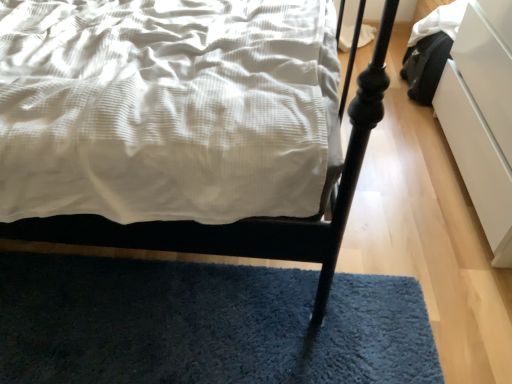
This screenshot has height=384, width=512. I want to click on white glossy drawer at right, so click(477, 161).

Consider the image. In order to face blue shaggy rug at lower center, should I rotate leftwards or rightwards?

Rotate your view left by about 7.622°.

What do you see at coordinates (205, 324) in the screenshot?
I see `blue shaggy rug at lower center` at bounding box center [205, 324].

The height and width of the screenshot is (384, 512). Find the location of `white glossy drawer at right`. white glossy drawer at right is located at coordinates (477, 161).

Which is more to the left, blue shaggy rug at lower center or matte white bed at center?

matte white bed at center is more to the left.

Can you tell me how much blue shaggy rug at lower center and matte white bed at center differ in facing direction?

blue shaggy rug at lower center and matte white bed at center are facing 89.7 degrees away from each other.

Between blue shaggy rug at lower center and matte white bed at center, which one has larger width?

matte white bed at center is wider.

Is matte white bed at center beside blue shaggy rug at lower center?

matte white bed at center and blue shaggy rug at lower center are clearly separated.

Which is behind, matte white bed at center or blue shaggy rug at lower center?

blue shaggy rug at lower center is more distant.

From the image's perspective, which one is positioned lower, matte white bed at center or blue shaggy rug at lower center?

From the image's view, blue shaggy rug at lower center is below.

The width and height of the screenshot is (512, 384). Find the location of `bed above the blue shaggy rug at lower center (from a real-world perspective)`. bed above the blue shaggy rug at lower center (from a real-world perspective) is located at coordinates (248, 218).

Is the surface of white glossy drawer at right in direct contact with matte white bed at center?

white glossy drawer at right and matte white bed at center are not in contact.

I want to click on bed above the white glossy drawer at right (from the image's perspective), so click(248, 218).

Is white glossy drawer at right positioned with its back to matte white bed at center?

white glossy drawer at right does not have its back to matte white bed at center.

Does white glossy drawer at right have a lesser width compared to blue shaggy rug at lower center?

Correct, the width of white glossy drawer at right is less than that of blue shaggy rug at lower center.

Considering the sizes of objects white glossy drawer at right and blue shaggy rug at lower center in the image provided, who is bigger, white glossy drawer at right or blue shaggy rug at lower center?

With larger size is white glossy drawer at right.

From the image's perspective, would you say white glossy drawer at right is shown under blue shaggy rug at lower center?

No, from the image's perspective, white glossy drawer at right is not beneath blue shaggy rug at lower center.

Between white glossy drawer at right and blue shaggy rug at lower center, which one is positioned in front?

white glossy drawer at right.

The image size is (512, 384). What are the coordinates of `drawer above the blue shaggy rug at lower center (from a real-world perspective)` in the screenshot? It's located at (477, 161).

Considering the relative sizes of blue shaggy rug at lower center and white glossy drawer at right in the image provided, is blue shaggy rug at lower center bigger than white glossy drawer at right?

No, blue shaggy rug at lower center is not bigger than white glossy drawer at right.

Is blue shaggy rug at lower center facing away from white glossy drawer at right?

No, white glossy drawer at right is not at the back of blue shaggy rug at lower center.

Which of these two, blue shaggy rug at lower center or white glossy drawer at right, stands taller?

Standing taller between the two is white glossy drawer at right.

Is matte white bed at center aimed at white glossy drawer at right?

Yes, matte white bed at center is turned towards white glossy drawer at right.

Between matte white bed at center and white glossy drawer at right, which one has less height?

→ white glossy drawer at right is shorter.

Consider the image. Is matte white bed at center at the left side of white glossy drawer at right?

Indeed, matte white bed at center is positioned on the left side of white glossy drawer at right.

You are a GUI agent. You are given a task and a screenshot of the screen. Output one action in this format:
    pyautogui.click(x=<x>, y=<y>)
    Task: Click on the mat that appears on the right of matte white bed at center
    The height and width of the screenshot is (384, 512).
    Given the screenshot: What is the action you would take?
    pyautogui.click(x=205, y=324)

The width and height of the screenshot is (512, 384). I want to click on mat behind the matte white bed at center, so click(205, 324).

From the image, which object appears to be nearer to white glossy drawer at right, blue shaggy rug at lower center or matte white bed at center?

blue shaggy rug at lower center is positioned closer to the anchor white glossy drawer at right.

Which object lies nearer to the anchor point white glossy drawer at right, matte white bed at center or blue shaggy rug at lower center?

blue shaggy rug at lower center.

Considering their positions, is white glossy drawer at right positioned further to matte white bed at center than blue shaggy rug at lower center?

The object further to matte white bed at center is white glossy drawer at right.

Which object lies nearer to the anchor point matte white bed at center, blue shaggy rug at lower center or white glossy drawer at right?

The object closer to matte white bed at center is blue shaggy rug at lower center.

From the image, which object appears to be nearer to blue shaggy rug at lower center, white glossy drawer at right or matte white bed at center?

matte white bed at center is positioned closer to the anchor blue shaggy rug at lower center.

From the image, which object appears to be farther from blue shaggy rug at lower center, matte white bed at center or white glossy drawer at right?

white glossy drawer at right.

This screenshot has height=384, width=512. In order to click on mat between matte white bed at center and white glossy drawer at right from left to right in this screenshot , I will do `click(205, 324)`.